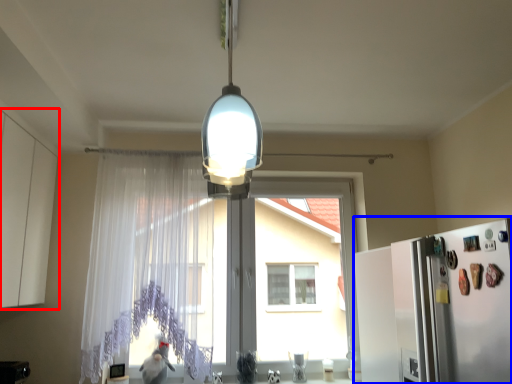
Question: Among these objects, which one is nearest to the camera, cabinetry (highlighted by a red box) or fridge (highlighted by a blue box)?

Choices:
 (A) cabinetry
 (B) fridge

Answer: (B)